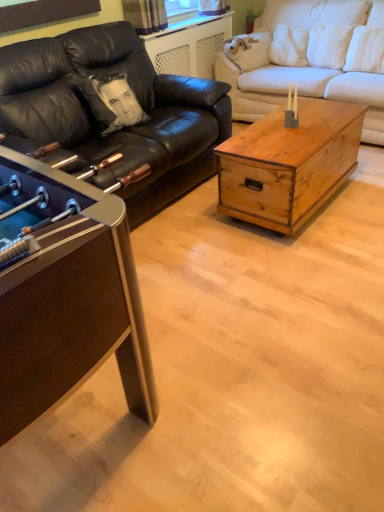
Question: Is rustic wood trunk at center, positioned as the second coffee table in left-to-right order, not inside white fabric couch at center, the 2th studio couch from the left?

Choices:
 (A) no
 (B) yes

Answer: (B)

Question: Does rustic wood trunk at center, which appears as the 1th coffee table when viewed from the right, have a lesser height compared to white fabric couch at center, the 2th studio couch from the left?

Choices:
 (A) no
 (B) yes

Answer: (B)

Question: From the image's perspective, is rustic wood trunk at center, which appears as the 1th coffee table when viewed from the right, below white fabric couch at center, the 2th studio couch from the left?

Choices:
 (A) yes
 (B) no

Answer: (A)

Question: Can you confirm if rustic wood trunk at center, positioned as the second coffee table in left-to-right order, is taller than white fabric couch at center, which is counted as the 1th studio couch, starting from the right?

Choices:
 (A) yes
 (B) no

Answer: (B)

Question: Is white fabric couch at center, which is counted as the 1th studio couch, starting from the right, a part of rustic wood trunk at center, which appears as the 1th coffee table when viewed from the right?

Choices:
 (A) no
 (B) yes

Answer: (A)

Question: Does rustic wood trunk at center, which appears as the 1th coffee table when viewed from the right, have a smaller size compared to white fabric couch at center, the 2th studio couch from the left?

Choices:
 (A) no
 (B) yes

Answer: (B)

Question: Does metallic brown foosball table at left, the second coffee table positioned from the right, appear on the left side of black leather couch at left, positioned as the first studio couch in left-to-right order?

Choices:
 (A) yes
 (B) no

Answer: (A)

Question: Does metallic brown foosball table at left, which is the first coffee table from left to right, have a lesser height compared to black leather couch at left, positioned as the first studio couch in left-to-right order?

Choices:
 (A) yes
 (B) no

Answer: (A)

Question: Is metallic brown foosball table at left, which is the first coffee table from left to right, positioned far away from black leather couch at left, arranged as the second studio couch when viewed from the right?

Choices:
 (A) yes
 (B) no

Answer: (A)

Question: Considering the relative positions of metallic brown foosball table at left, which is the first coffee table from left to right, and black leather couch at left, arranged as the second studio couch when viewed from the right, in the image provided, is metallic brown foosball table at left, which is the first coffee table from left to right, to the right of black leather couch at left, arranged as the second studio couch when viewed from the right, from the viewer's perspective?

Choices:
 (A) yes
 (B) no

Answer: (B)

Question: Can you confirm if metallic brown foosball table at left, the second coffee table positioned from the right, is wider than black leather couch at left, positioned as the first studio couch in left-to-right order?

Choices:
 (A) no
 (B) yes

Answer: (A)

Question: Does metallic brown foosball table at left, the second coffee table positioned from the right, lie behind black leather couch at left, arranged as the second studio couch when viewed from the right?

Choices:
 (A) yes
 (B) no

Answer: (B)

Question: Considering the relative sizes of black leather couch at left, positioned as the first studio couch in left-to-right order, and white fabric couch at center, the 2th studio couch from the left, in the image provided, is black leather couch at left, positioned as the first studio couch in left-to-right order, taller than white fabric couch at center, the 2th studio couch from the left,?

Choices:
 (A) yes
 (B) no

Answer: (B)